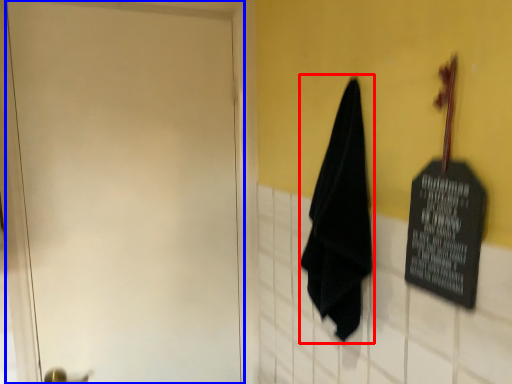
Question: Which point is further to the camera, cloth (highlighted by a red box) or door (highlighted by a blue box)?

Choices:
 (A) cloth
 (B) door

Answer: (B)